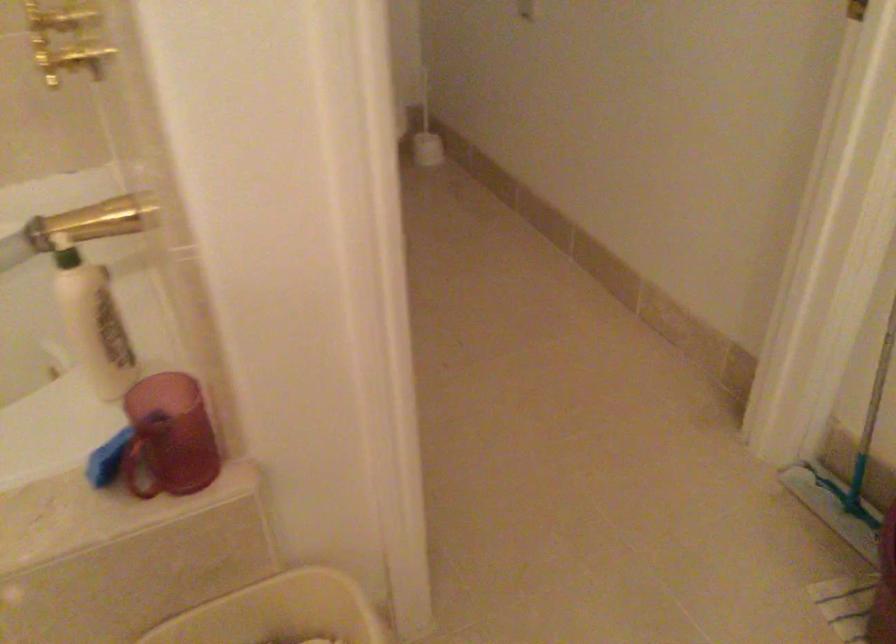
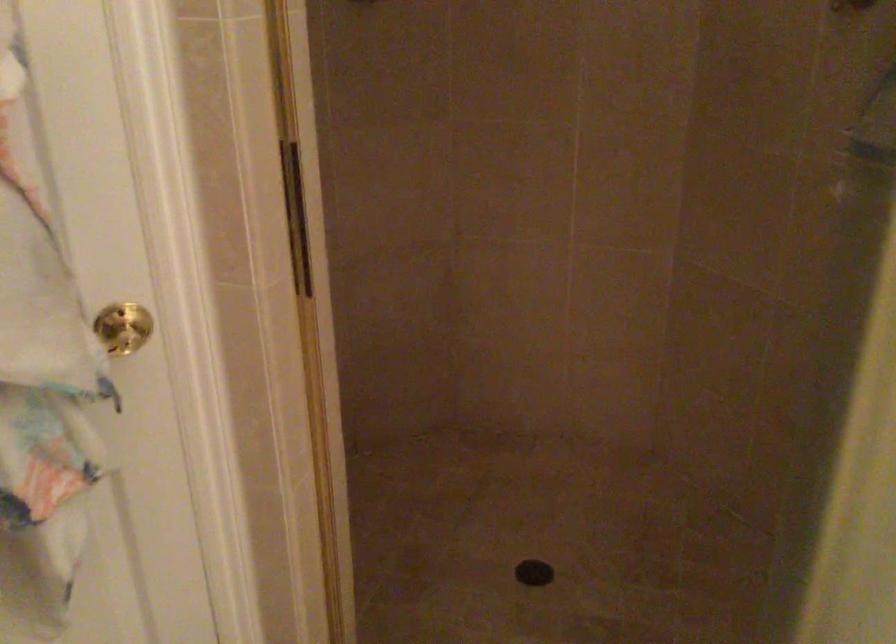
In the scene shown: Based on the continuous images, in which direction is the camera rotating?

The rotation direction of the camera is right-down.